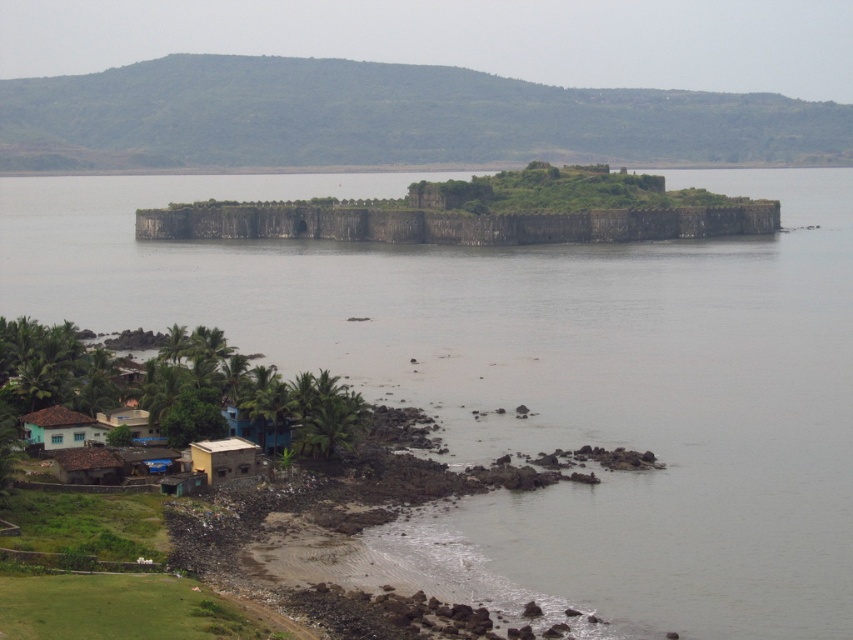
Question: Observing the image, what is the correct spatial positioning of teal matte house at lower left in reference to brown corrugated roof hut at lower left?

Choices:
 (A) above
 (B) below

Answer: (A)

Question: Estimate the real-world distances between objects in this image. Which object is closer to the gray water at center?

Choices:
 (A) blue corrugated metal hut at lower left
 (B) brown corrugated roof hut at lower left
 (C) teal matte house at lower left

Answer: (A)

Question: Which object is farther from the camera taking this photo?

Choices:
 (A) yellow matte hut at lower left
 (B) blue corrugated metal hut at lower left
 (C) gray water at center

Answer: (B)

Question: Does blue corrugated metal hut at lower center appear on the left side of blue corrugated metal hut at lower left?

Choices:
 (A) no
 (B) yes

Answer: (A)

Question: Does gray water at center appear on the right side of blue corrugated metal hut at lower center?

Choices:
 (A) no
 (B) yes

Answer: (B)

Question: Which point is farther from the camera taking this photo?

Choices:
 (A) (91, 433)
 (B) (665, 397)
 (C) (64, 460)

Answer: (B)